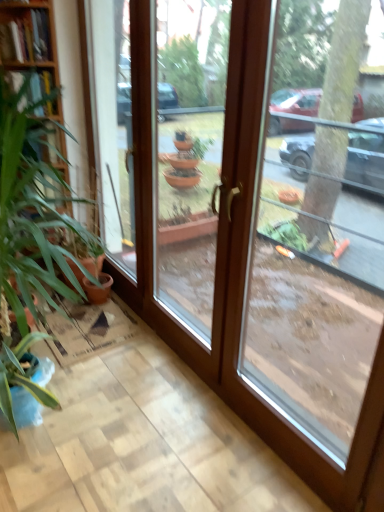
Question: Is transparent glass door at center, positioned as the 2th window in right-to-left order, in front of or behind green leafy plant at left in the image?

Choices:
 (A) behind
 (B) front

Answer: (B)

Question: In terms of height, does transparent glass door at center, positioned as the 2th window in right-to-left order, look taller or shorter compared to green leafy plant at left?

Choices:
 (A) short
 (B) tall

Answer: (B)

Question: Which of these objects is positioned farthest from the transparent glass door at center, positioned as the 2th window in right-to-left order?

Choices:
 (A) green leafy plant at left
 (B) wooden bookshelf at left
 (C) transparent glass door at right, positioned as the 1th window in right-to-left order

Answer: (C)

Question: Estimate the real-world distances between objects in this image. Which object is farther from the green leafy plant at left?

Choices:
 (A) transparent glass door at right, acting as the 2th window starting from the left
 (B) wooden bookshelf at left
 (C) transparent glass door at center, the first window when ordered from left to right

Answer: (C)